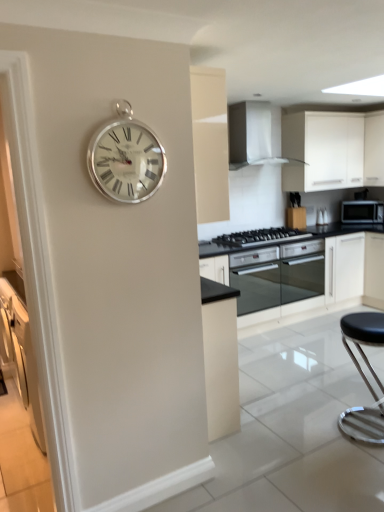
Question: Considering the relative sizes of white matte cabinet at upper right and black glass oven at center, acting as the 1th oven starting from the right, in the image provided, is white matte cabinet at upper right thinner than black glass oven at center, acting as the 1th oven starting from the right,?

Choices:
 (A) yes
 (B) no

Answer: (A)

Question: Considering the relative sizes of white matte cabinet at upper right and black glass oven at center, positioned as the second oven in left-to-right order, in the image provided, is white matte cabinet at upper right bigger than black glass oven at center, positioned as the second oven in left-to-right order,?

Choices:
 (A) yes
 (B) no

Answer: (A)

Question: Does white matte cabinet at upper right turn towards black glass oven at center, positioned as the second oven in left-to-right order?

Choices:
 (A) no
 (B) yes

Answer: (A)

Question: Can you confirm if white matte cabinet at upper right is wider than black glass oven at center, acting as the 1th oven starting from the right?

Choices:
 (A) no
 (B) yes

Answer: (A)

Question: Is white matte cabinet at upper right further to the viewer compared to black glass oven at center, positioned as the second oven in left-to-right order?

Choices:
 (A) no
 (B) yes

Answer: (B)

Question: Relative to black matte microwave at right, is black leather stool at lower right in front or behind?

Choices:
 (A) behind
 (B) front

Answer: (B)

Question: Is point (377, 430) closer or farther from the camera than point (342, 202)?

Choices:
 (A) closer
 (B) farther

Answer: (A)

Question: From the image's perspective, is black leather stool at lower right above or below black matte microwave at right?

Choices:
 (A) below
 (B) above

Answer: (A)

Question: Is black leather stool at lower right inside or outside of black matte microwave at right?

Choices:
 (A) outside
 (B) inside

Answer: (A)

Question: In terms of height, does black glass oven at center, the second oven viewed from the right, look taller or shorter compared to black glass oven at center, acting as the 1th oven starting from the right?

Choices:
 (A) short
 (B) tall

Answer: (B)

Question: From a real-world perspective, is black glass oven at center, placed as the first oven when sorted from left to right, positioned above or below black glass oven at center, acting as the 1th oven starting from the right?

Choices:
 (A) above
 (B) below

Answer: (A)

Question: Is black glass oven at center, placed as the first oven when sorted from left to right, wider or thinner than black glass oven at center, positioned as the second oven in left-to-right order?

Choices:
 (A) wide
 (B) thin

Answer: (A)

Question: In the image, is black glass oven at center, placed as the first oven when sorted from left to right, positioned in front of or behind black glass oven at center, positioned as the second oven in left-to-right order?

Choices:
 (A) front
 (B) behind

Answer: (A)

Question: Is black glass gas stove at center inside the boundaries of black glass oven at center, placed as the first oven when sorted from left to right, or outside?

Choices:
 (A) inside
 (B) outside

Answer: (B)

Question: In terms of size, does black glass gas stove at center appear bigger or smaller than black glass oven at center, the second oven viewed from the right?

Choices:
 (A) small
 (B) big

Answer: (A)